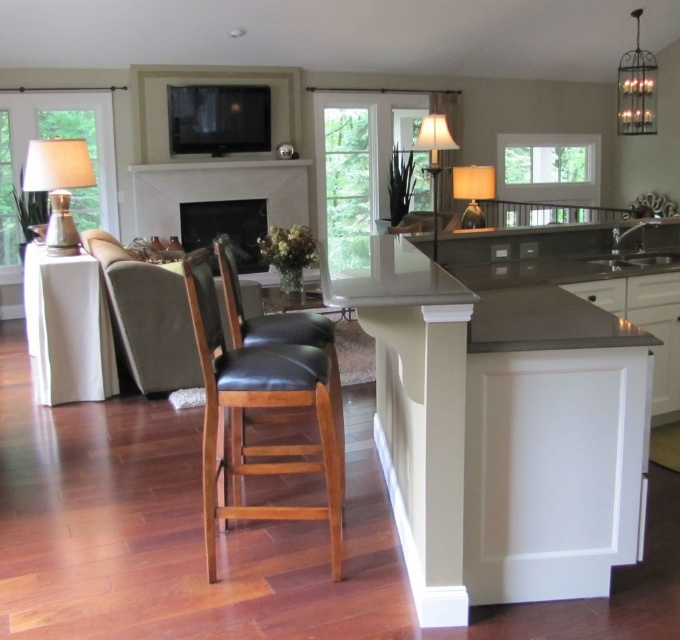
You are standing in the living room and want to move towards the two points marked in the image. Which point, point (248, 456) or point (152, 214), is closer to you?

Point (248, 456) is closer to the viewer than point (152, 214).

You are planning to install a new light fixture in the living room and want to know the relative positions of the existing lights. Which object is located to the right of the other between the metallic chandelier at upper right and the matte brown table lamp at upper right?

The metallic chandelier at upper right is positioned on the right side of the matte brown table lamp at upper right.

Please look at the image. There is a point marked at coordinates (260,406). Which object is located at that point?

The point at coordinates (260,406) indicates the location of the black leather chair at center.